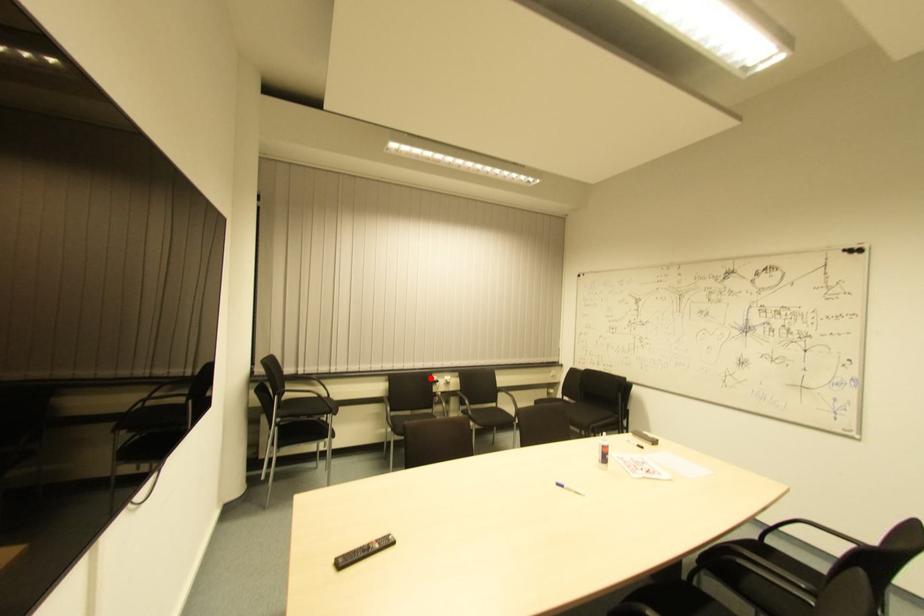
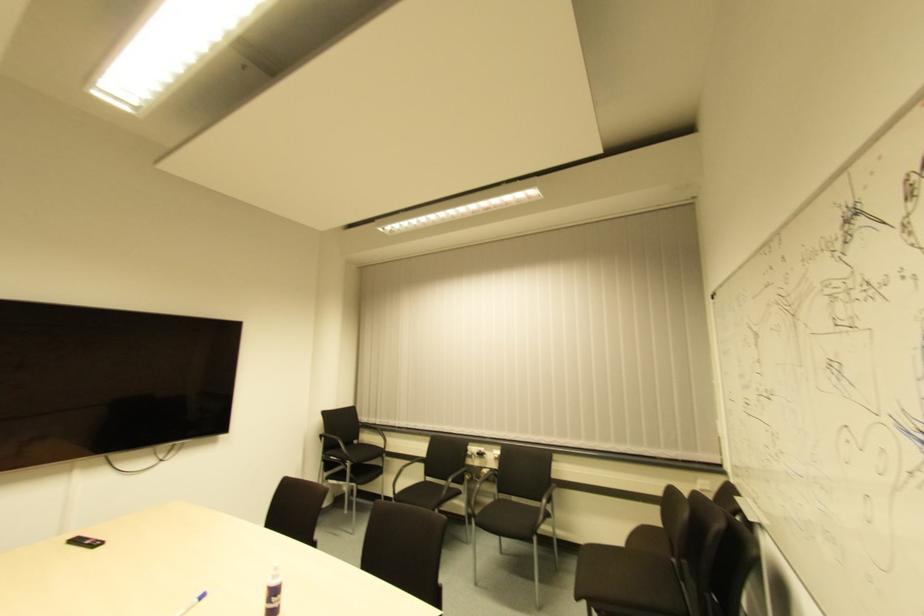
Where in the second image is the point corresponding to the highlighted location from the first image?

(468, 447)